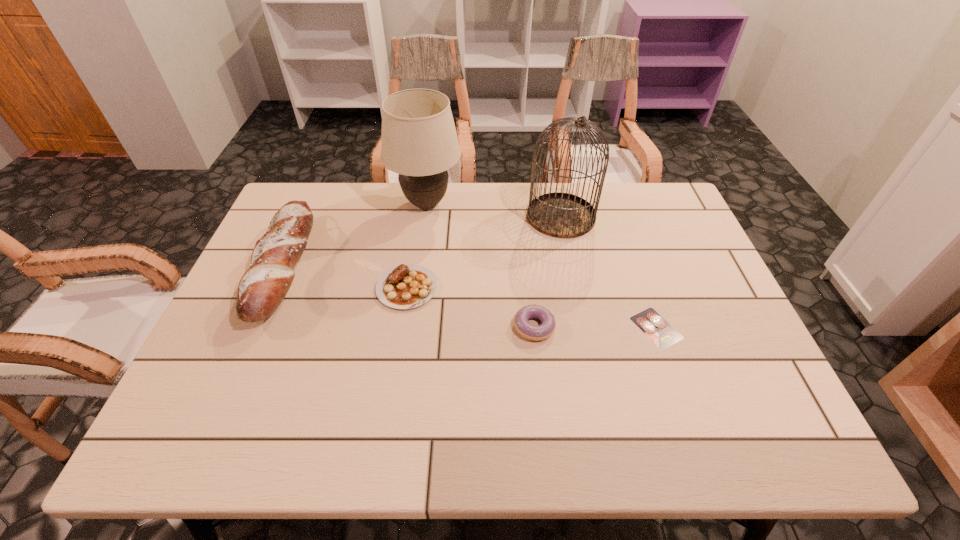
You are a GUI agent. You are given a task and a screenshot of the screen. Output one action in this format:
    pyautogui.click(x=<x>, y=<y>)
    Task: Click on the vacant space at the far edge of the desktop
    
    Given the screenshot: What is the action you would take?
    pyautogui.click(x=430, y=223)

In the image, there is a desktop. At what (x,y) coordinates should I click in order to perform the action: click on vacant space at the near edge. Please return your answer as a coordinate pair (x, y). The height and width of the screenshot is (540, 960). Looking at the image, I should click on (403, 414).

Identify the location of free spot at the left edge of the desktop. (213, 378).

I want to click on vacant space at the right edge, so click(x=681, y=279).

Locate an element on the screen. blank space at the far left corner of the desktop is located at coordinates (290, 190).

Locate an element on the screen. blank space at the near left corner of the desktop is located at coordinates (158, 454).

Locate an element on the screen. Image resolution: width=960 pixels, height=540 pixels. vacant space at the far right corner of the desktop is located at coordinates (674, 208).

Locate an element on the screen. The height and width of the screenshot is (540, 960). free area in between the steak and the doughnut is located at coordinates (470, 307).

You are a GUI agent. You are given a task and a screenshot of the screen. Output one action in this format:
    pyautogui.click(x=<x>, y=<y>)
    Task: Click on the vacant area that lies between the rightmost object and the baguet
    This screenshot has height=540, width=960.
    Given the screenshot: What is the action you would take?
    pyautogui.click(x=470, y=297)

Find the location of a particular element. This screenshot has height=540, width=960. free space between the doughnut and the shortest object is located at coordinates tap(595, 327).